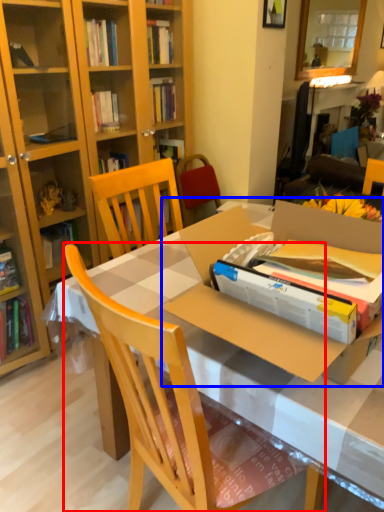
Question: Among these objects, which one is nearest to the camera, chair (highlighted by a red box) or cardboard box (highlighted by a blue box)?

Choices:
 (A) chair
 (B) cardboard box

Answer: (A)